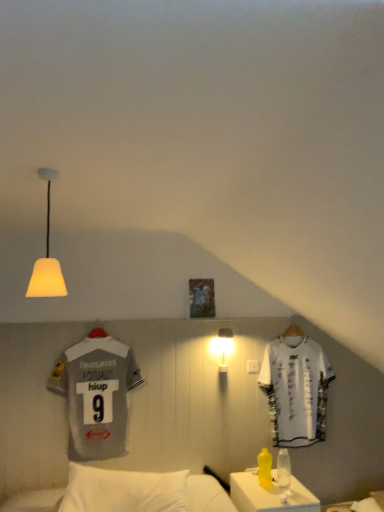
You are a GUI agent. You are given a task and a screenshot of the screen. Output one action in this format:
    pyautogui.click(x=<x>, y=<y>)
    Task: Click on the space that is in front of yellow matte bottle at lower right, which is counted as the 1th bottle, starting from the left
    This screenshot has width=384, height=512.
    Given the screenshot: What is the action you would take?
    pyautogui.click(x=278, y=501)